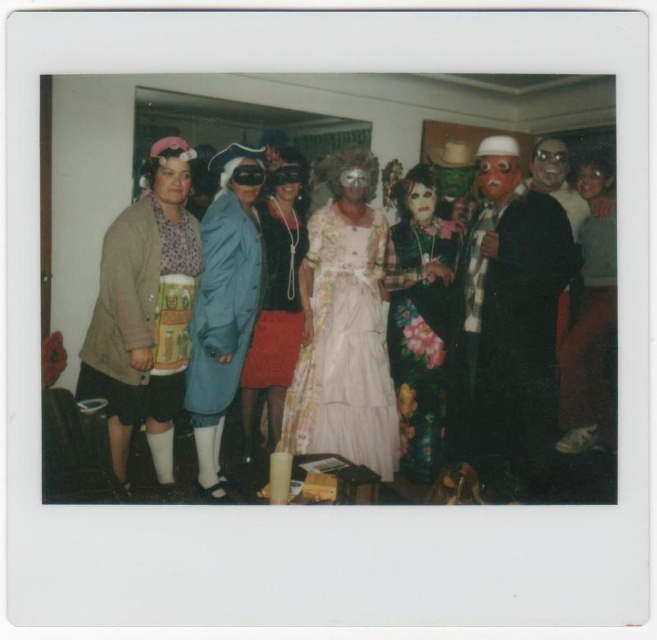
You are organizing a photo shoot and need to place two props next to the floral lace dress at center and the matte blue coat at center. If the space available is limited, which object should you prioritize placing first based on their widths?

The floral lace dress at center might be wider than matte blue coat at center, so you should prioritize placing the floral lace dress at center first to accommodate its width.

You are holding a camera and want to take a closeup shot of the matte black mask at center. Based on the scene, can you determine if you are within the recommended 5 feet focus range for a clear photo?

The matte black mask at center is 8.07 feet away from the camera, which is beyond the recommended 5 feet focus range for a clear photo.

From the picture: You are a photographer reviewing this Polaroid image. You notice the floral fabric dress at center and the matte blue coat at center. Which one appears closer to the camera lens?

The floral fabric dress at center is in front of the matte blue coat at center, so it appears closer to the camera lens.